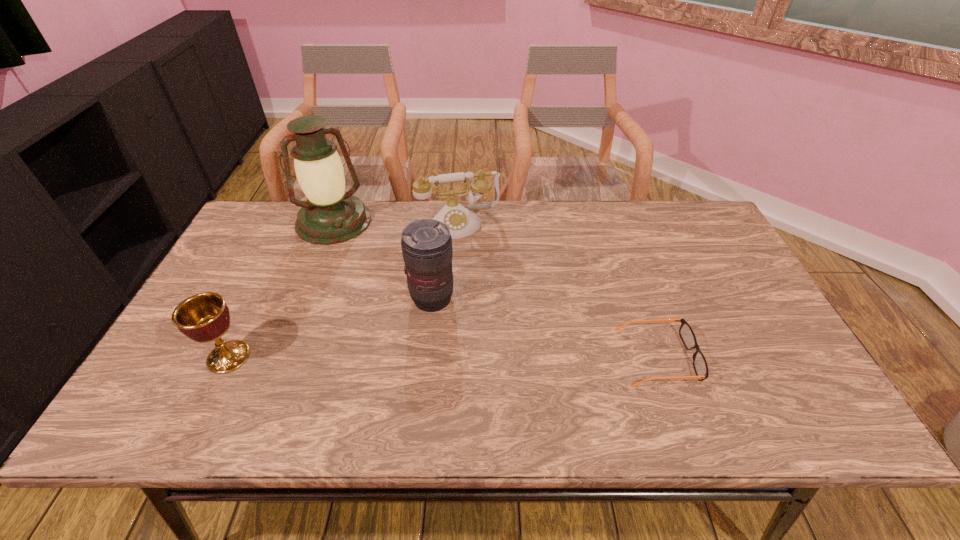
The width and height of the screenshot is (960, 540). What are the coordinates of `free location located 0.070m on the side of the telephoto lens where the control switches are located` in the screenshot? It's located at (460, 330).

At what (x,y) coordinates should I click in order to perform the action: click on vacant region located on the side of the telephoto lens where the control switches are located. Please return your answer as a coordinate pair (x, y). The height and width of the screenshot is (540, 960). Looking at the image, I should click on (471, 343).

Identify the location of free spot located on the dial of the telephone. (484, 296).

The width and height of the screenshot is (960, 540). Identify the location of free location located 0.350m on the dial of the telephone. (492, 324).

Where is `vacant space located 0.230m on the dial of the telephone`? This screenshot has width=960, height=540. vacant space located 0.230m on the dial of the telephone is located at coordinates (482, 291).

This screenshot has width=960, height=540. What are the coordinates of `blank space located 0.340m with the light compartment facing forward on the tallest object` in the screenshot? It's located at (375, 318).

What are the coordinates of `free location located 0.320m with the light compartment facing forward on the tallest object` in the screenshot? It's located at (373, 313).

What are the coordinates of `vacant space situated with the light compartment facing forward on the tallest object` in the screenshot? It's located at (361, 284).

The width and height of the screenshot is (960, 540). I want to click on telephone at the far edge, so click(461, 222).

The height and width of the screenshot is (540, 960). In order to click on lantern that is at the far edge in this screenshot , I will do `click(331, 216)`.